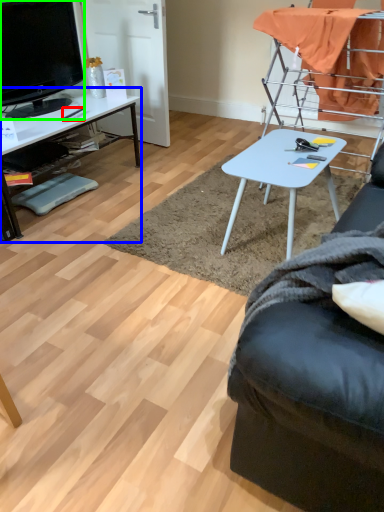
Question: Considering the real-world distances, which object is farthest from pen (highlighted by a red box)? desk (highlighted by a blue box) or television (highlighted by a green box)?

Choices:
 (A) desk
 (B) television

Answer: (B)